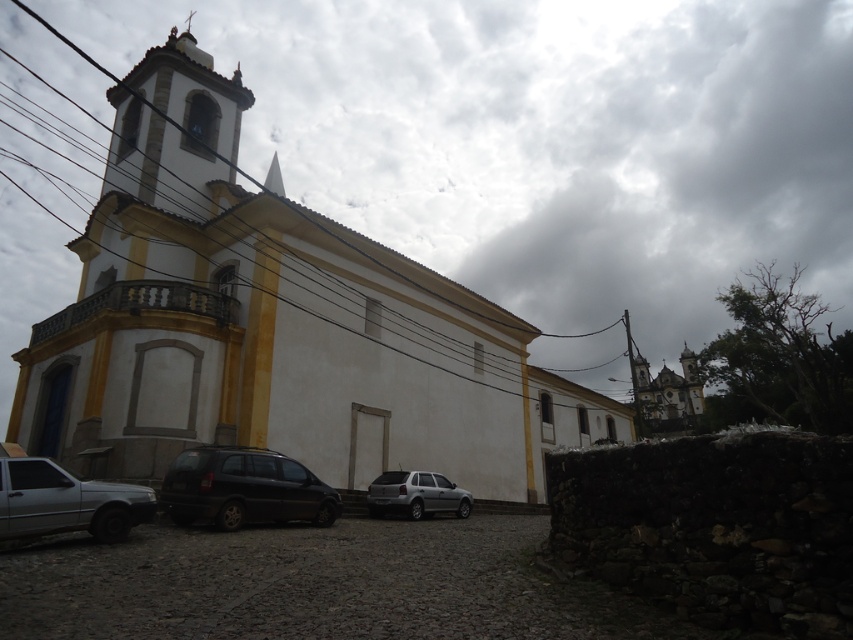
Looking at this image, you are a delivery person standing at the entrance of the church. You need to park your delivery van, which is 6 meters long, in the closest available spot. The black matte van at lower left is already parked there. Can you fit your van in the same spot without moving the existing van?

The black matte van at lower left is 18.01 meters from the camera. Since the distance from the camera to the van is greater than the length of your van, you can park your 6 meter long van in the same spot without moving the existing van.

You are a delivery driver who needs to back out of the parking spot. You see the black matte van at lower left and the satin silver suv at center. Which vehicle is blocking your path?

The black matte van at lower left is blocking your path because it is in front of the satin silver suv at center.

You are a delivery driver who needs to park your black matte van at lower left in a spot that can accommodate its width. You see the white smooth church at center nearby. Can you determine if the van will fit in a parking spot that is as wide as the church?

The white smooth church at center is wider than the black matte van at lower left, so the van will fit in a parking spot that matches the church width.